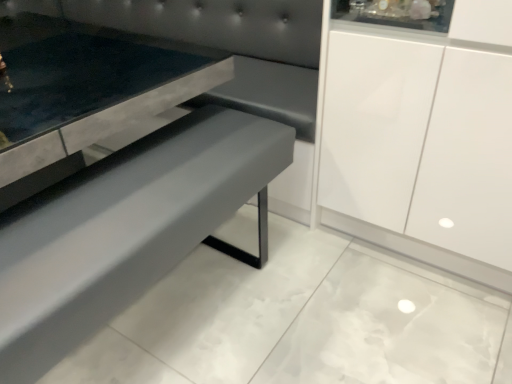
Question: Considering their positions, is matte gray bench at center located in front of or behind suede-like gray couch at center?

Choices:
 (A) behind
 (B) front

Answer: (B)

Question: From the image's perspective, is matte gray bench at center located above or below suede-like gray couch at center?

Choices:
 (A) below
 (B) above

Answer: (A)

Question: In terms of size, does matte gray bench at center appear bigger or smaller than suede-like gray couch at center?

Choices:
 (A) small
 (B) big

Answer: (A)

Question: From a real-world perspective, is suede-like gray couch at center positioned above or below matte gray bench at center?

Choices:
 (A) below
 (B) above

Answer: (B)

Question: Visually, is suede-like gray couch at center positioned to the left or to the right of matte gray bench at center?

Choices:
 (A) left
 (B) right

Answer: (A)

Question: In terms of size, does suede-like gray couch at center appear bigger or smaller than matte gray bench at center?

Choices:
 (A) big
 (B) small

Answer: (A)

Question: Relative to matte gray bench at center, is suede-like gray couch at center in front or behind?

Choices:
 (A) behind
 (B) front

Answer: (A)